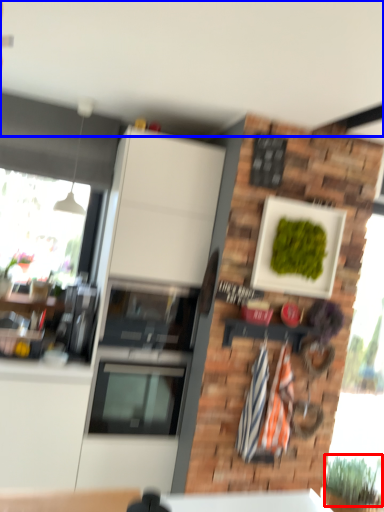
Question: Among these objects, which one is farthest to the camera, plant (highlighted by a red box) or backdrop (highlighted by a blue box)?

Choices:
 (A) plant
 (B) backdrop

Answer: (A)